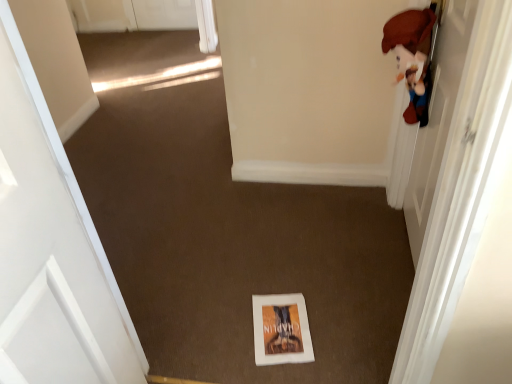
Find the location of a particular element. The height and width of the screenshot is (384, 512). vacant area situated below white glossy door at upper right, which is counted as the first door, starting from the right (from a real-world perspective) is located at coordinates (398, 255).